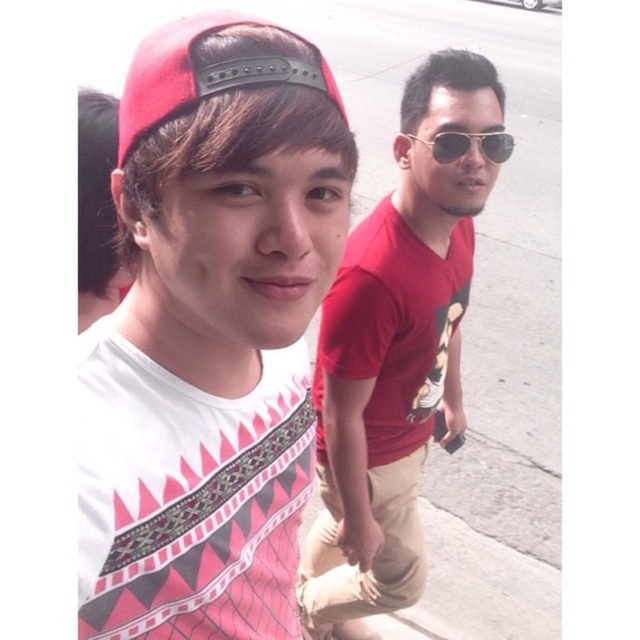
Question: Among these objects, which one is farthest from the camera?

Choices:
 (A) matte red baseball cap at upper left
 (B) matte red t-shirt at center
 (C) matte pink cap at upper left
 (D) sunglasses at center

Answer: (B)

Question: Does matte red baseball cap at upper left appear over sunglasses at center?

Choices:
 (A) no
 (B) yes

Answer: (A)

Question: Does matte red t-shirt at center have a lesser width compared to sunglasses at center?

Choices:
 (A) yes
 (B) no

Answer: (B)

Question: Which is farther from the sunglasses at center?

Choices:
 (A) matte pink cap at upper left
 (B) matte red t-shirt at center
 (C) matte red baseball cap at upper left

Answer: (A)

Question: Which object is the closest to the matte pink cap at upper left?

Choices:
 (A) matte red t-shirt at center
 (B) sunglasses at center
 (C) matte red baseball cap at upper left

Answer: (C)

Question: From the image, what is the correct spatial relationship of matte red t-shirt at center in relation to sunglasses at center?

Choices:
 (A) above
 (B) below

Answer: (B)